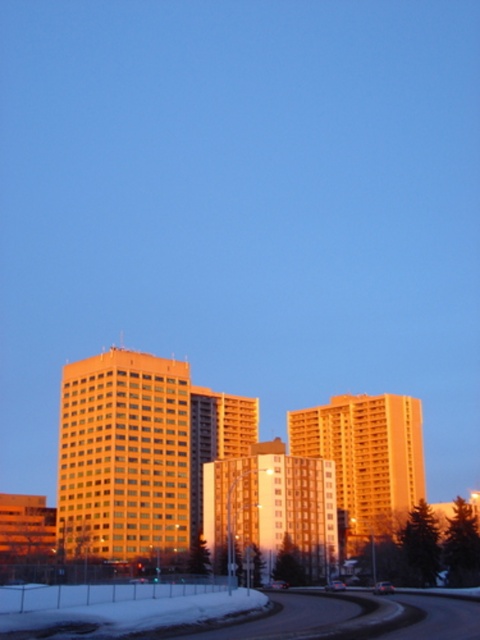
Question: Is matte glass building at center positioned behind orange glass building at center?

Choices:
 (A) no
 (B) yes

Answer: (B)

Question: Is matte glass building at center behind snowy asphalt highway at lower center?

Choices:
 (A) yes
 (B) no

Answer: (A)

Question: Does golden glass building at center appear on the right side of orange glass building at center?

Choices:
 (A) no
 (B) yes

Answer: (B)

Question: Among these points, which one is nearest to the camera?

Choices:
 (A) (215, 504)
 (B) (386, 596)
 (C) (351, 394)
 (D) (98, 504)

Answer: (B)

Question: Which point is farther to the camera?

Choices:
 (A) golden glass building at center
 (B) orange glass building at center

Answer: (A)

Question: Which object appears farthest from the camera in this image?

Choices:
 (A) orange glass building at center
 (B) golden glass building at center

Answer: (B)